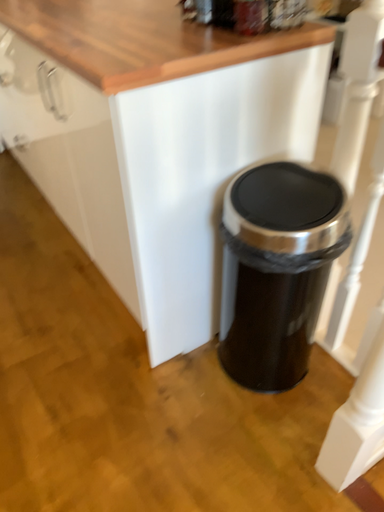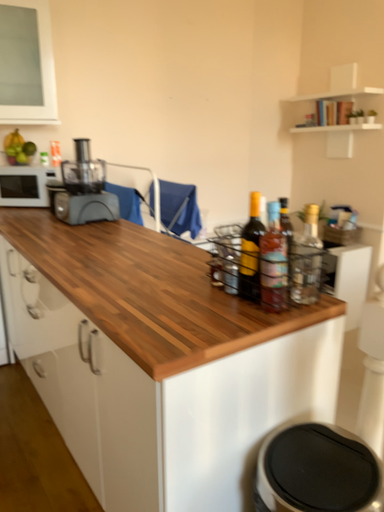
Question: Which way did the camera rotate in the video?

Choices:
 (A) rotated downward
 (B) rotated upward

Answer: (B)